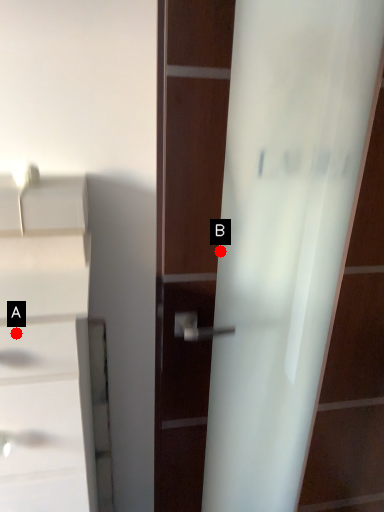
Question: Two points are circled on the image, labeled by A and B beside each circle. Which point is closer to the camera?

Choices:
 (A) A is closer
 (B) B is closer

Answer: (A)